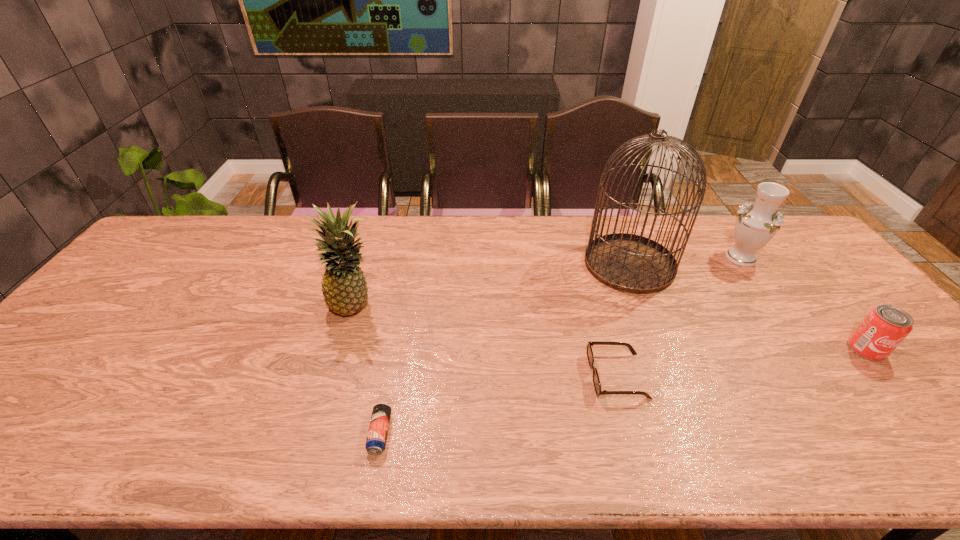
The image size is (960, 540). What are the coordinates of `vacant area situated 0.230m on the left of the birdcage` in the screenshot? It's located at (512, 264).

Identify the location of free region located on the back of the pineapple. (368, 265).

Locate an element on the screen. The image size is (960, 540). free spot located on the front of the fifth object from left to right is located at coordinates (769, 296).

Find the location of a particular element. The image size is (960, 540). free space located 0.050m on the left of the third shortest object is located at coordinates (829, 349).

Where is `vacant space positioned on the front-facing side of the sunglasses`? The height and width of the screenshot is (540, 960). vacant space positioned on the front-facing side of the sunglasses is located at coordinates click(x=543, y=376).

Locate an element on the screen. The width and height of the screenshot is (960, 540). vacant space located on the front-facing side of the sunglasses is located at coordinates (490, 376).

At what (x,y) coordinates should I click in order to perform the action: click on vacant area located 0.400m on the front-facing side of the sunglasses. Please return your answer as a coordinate pair (x, y). This screenshot has height=540, width=960. Looking at the image, I should click on [x=423, y=376].

Locate an element on the screen. The image size is (960, 540). vacant space located 0.060m on the left of the nearest object is located at coordinates (343, 434).

The image size is (960, 540). I want to click on birdcage positioned at the far edge, so click(x=630, y=263).

What are the coordinates of `vase present at the far edge` in the screenshot? It's located at (755, 226).